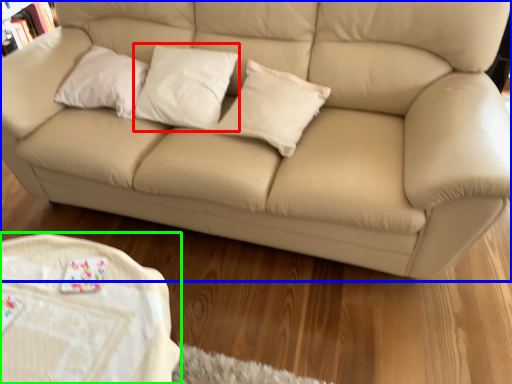
Question: Which is farther away from pillow (highlighted by a red box)? studio couch (highlighted by a blue box) or table (highlighted by a green box)?

Choices:
 (A) studio couch
 (B) table

Answer: (B)